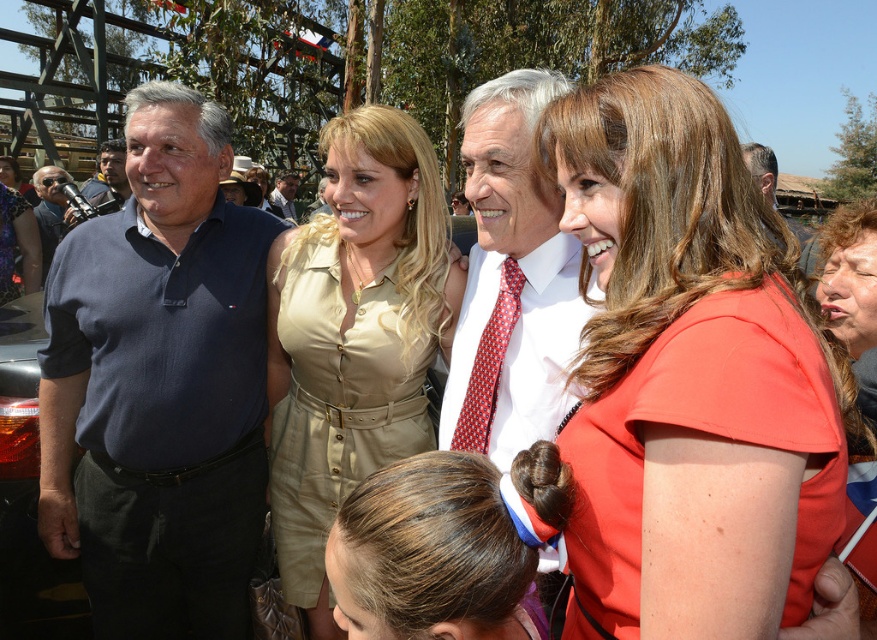
Question: Among these objects, which one is farthest from the camera?

Choices:
 (A) matte blue shirt at left
 (B) matte black shirt at upper center
 (C) white shirt with red tie at center

Answer: (A)

Question: Which point is farther to the camera?

Choices:
 (A) dark blue polo shirt at left
 (B) beige fabric dress at center
 (C) orange matte dress at right

Answer: (A)

Question: Is beige fabric dress at center wider than red dotted tie at center?

Choices:
 (A) no
 (B) yes

Answer: (B)

Question: Considering the relative positions of dark blue polo shirt at left and beige fabric dress at center in the image provided, where is dark blue polo shirt at left located with respect to beige fabric dress at center?

Choices:
 (A) below
 (B) above

Answer: (A)

Question: Does matte blue shirt at left have a smaller size compared to matte black shirt at upper center?

Choices:
 (A) no
 (B) yes

Answer: (B)

Question: Which object is closer to the camera taking this photo?

Choices:
 (A) matte khaki shirt at center
 (B) matte black shirt at upper center
 (C) beige fabric dress at center

Answer: (B)